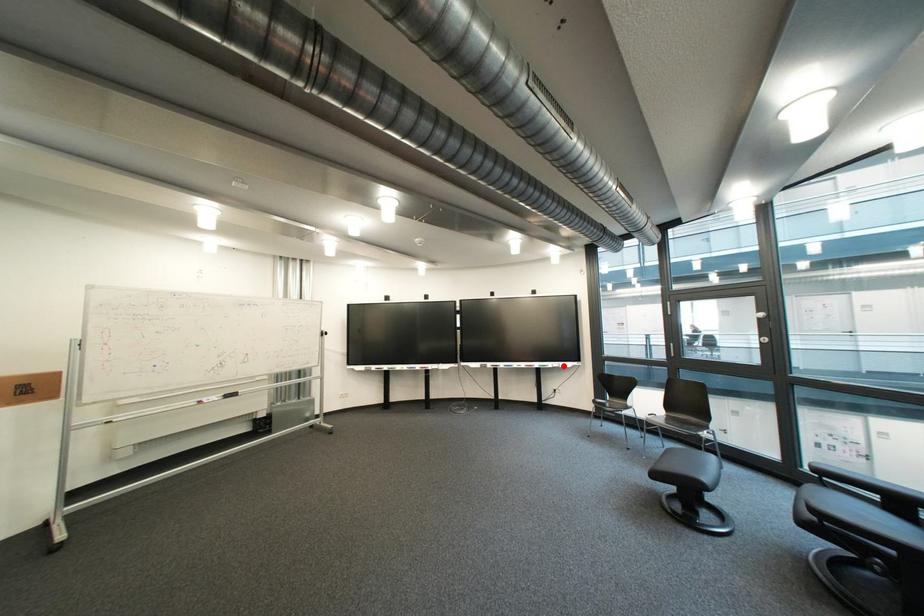
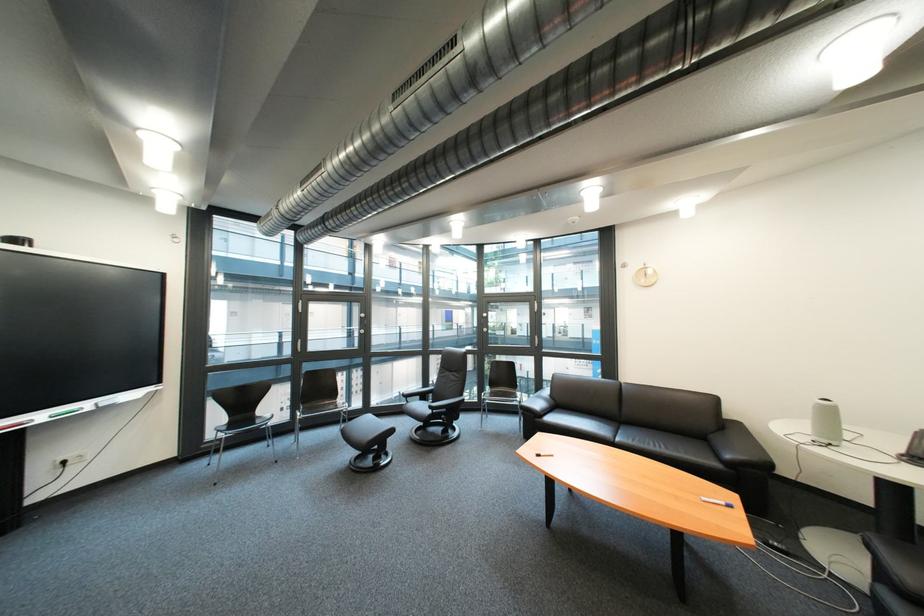
Find the pixel in the second image that matches the highlighted location in the first image.

(101, 406)